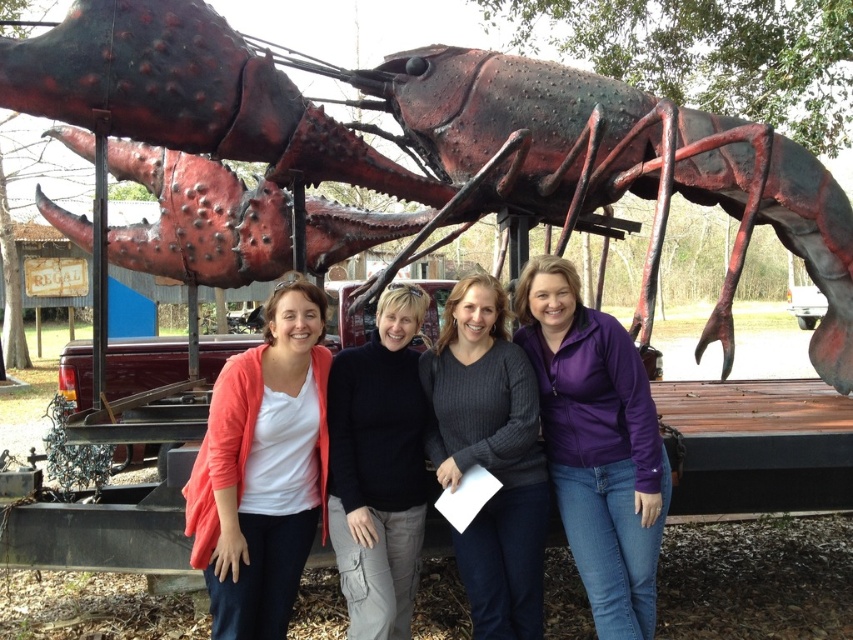
Based on the photo, who is positioned more to the right, metallic red lobster at center or black turtleneck sweater at center?

metallic red lobster at center is more to the right.

Does metallic red lobster at center have a larger size compared to black turtleneck sweater at center?

Correct, metallic red lobster at center is larger in size than black turtleneck sweater at center.

The image size is (853, 640). Describe the element at coordinates (408, 154) in the screenshot. I see `metallic red lobster at center` at that location.

You are a GUI agent. You are given a task and a screenshot of the screen. Output one action in this format:
    pyautogui.click(x=<x>, y=<y>)
    Task: Click on the metallic red lobster at center
    
    Given the screenshot: What is the action you would take?
    pyautogui.click(x=408, y=154)

Is purple fleece jacket at center in front of black turtleneck sweater at center?

Yes, purple fleece jacket at center is closer to the viewer.

At what (x,y) coordinates should I click in order to perform the action: click on purple fleece jacket at center. Please return your answer as a coordinate pair (x, y). The image size is (853, 640). Looking at the image, I should click on (596, 444).

Who is more distant from viewer, (x=625, y=460) or (x=346, y=369)?

Point (x=346, y=369)

I want to click on purple fleece jacket at center, so click(596, 444).

Which is above, matte orange cardigan at center or black turtleneck sweater at center?

matte orange cardigan at center is above.

Between matte orange cardigan at center and black turtleneck sweater at center, which one appears on the right side from the viewer's perspective?

Positioned to the right is black turtleneck sweater at center.

Does point (305, 545) come closer to viewer compared to point (334, 356)?

Yes, it is.

Find the location of a particular element. matte orange cardigan at center is located at coordinates (263, 468).